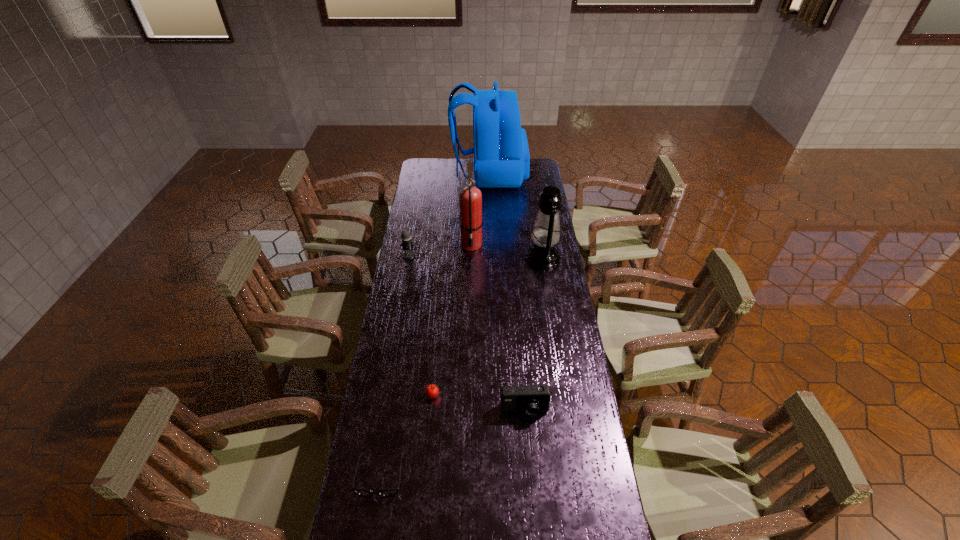
Where is `the farthest object`? Image resolution: width=960 pixels, height=540 pixels. the farthest object is located at coordinates (501, 154).

Where is `backpack`? This screenshot has width=960, height=540. backpack is located at coordinates (501, 154).

Locate an element on the screen. fire extinguisher is located at coordinates (470, 198).

Find the location of a particular element. oil lamp is located at coordinates (546, 233).

Identify the location of microphone. The width and height of the screenshot is (960, 540). (407, 244).

At what (x,y) coordinates should I click in order to perform the action: click on camera. Please return your answer as a coordinate pair (x, y). Image resolution: width=960 pixels, height=540 pixels. Looking at the image, I should click on (532, 399).

Image resolution: width=960 pixels, height=540 pixels. I want to click on cherry, so click(x=431, y=390).

Find the location of a particular element. The width and height of the screenshot is (960, 540). the shortest object is located at coordinates (362, 492).

Locate an element on the screen. the nearest object is located at coordinates (362, 492).

The width and height of the screenshot is (960, 540). I want to click on vacant space located 0.070m on the back of the farthest object, so click(x=440, y=174).